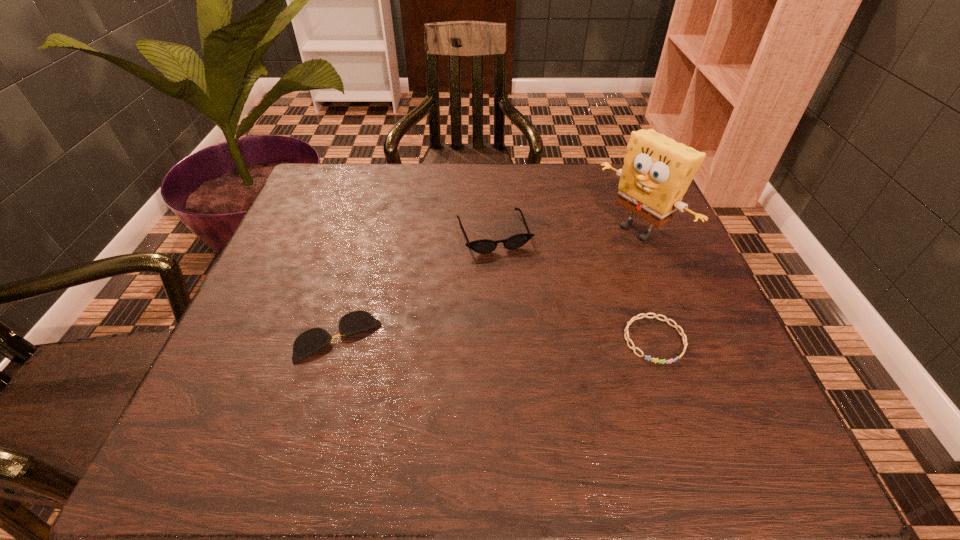
You are a GUI agent. You are given a task and a screenshot of the screen. Output one action in this format:
    pyautogui.click(x=<x>, y=<y>)
    Task: Click on the vacant spot on the desktop that is between the shortest object and the third tallest object and is positioned on the face of the tallest object
    The width and height of the screenshot is (960, 540).
    Given the screenshot: What is the action you would take?
    pyautogui.click(x=454, y=338)

Where is `vacant spot on the desktop that is between the leftmost object and the third tallest object and is positioned on the front-facing side of the sunglasses`? vacant spot on the desktop that is between the leftmost object and the third tallest object and is positioned on the front-facing side of the sunglasses is located at coordinates (536, 339).